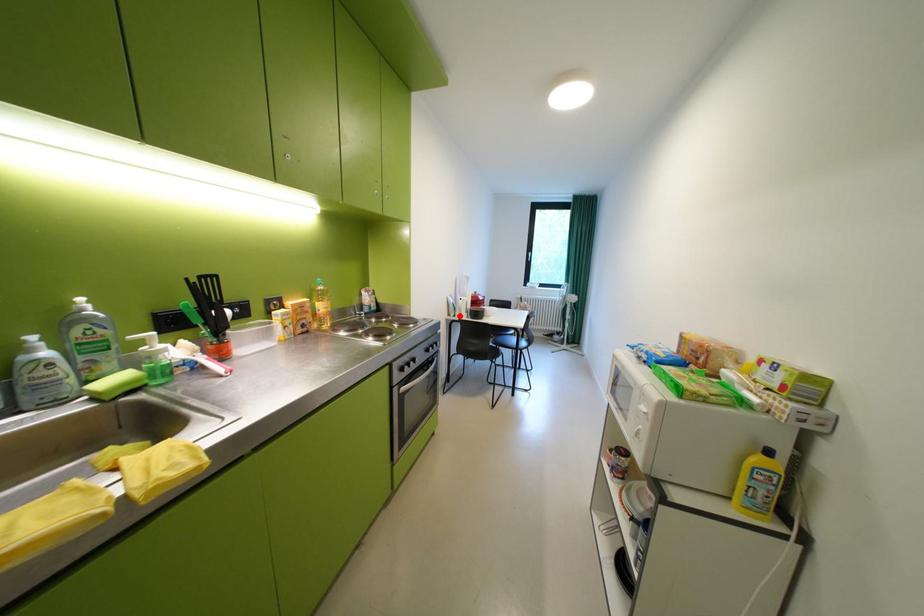
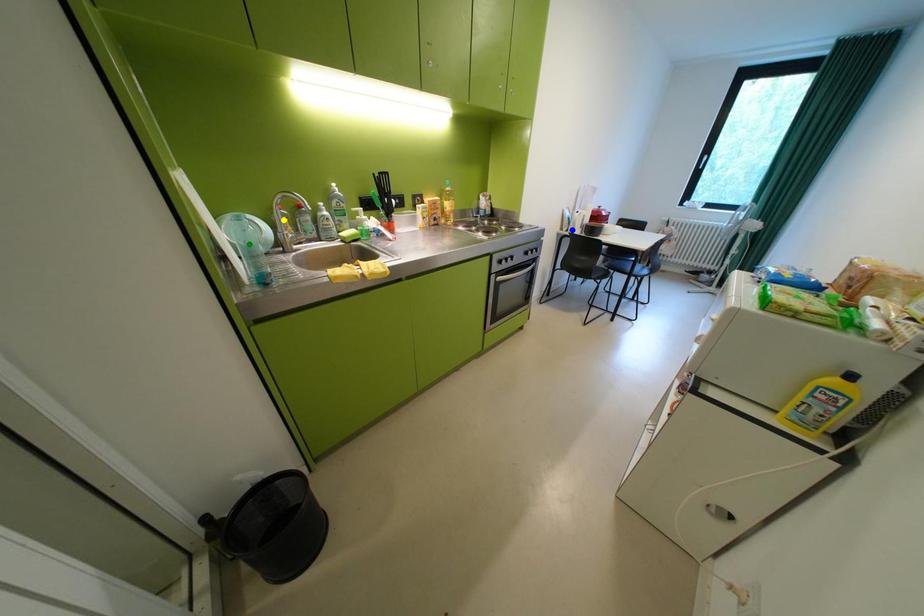
Question: I am providing you with two images of the same scene from different viewpoints. A red point is marked on the first image. You are given multiple points on the second image. Can you choose the point in image 2 that corresponds to the point in image 1?

Choices:
 (A) blue point
 (B) green point
 (C) yellow point

Answer: (A)